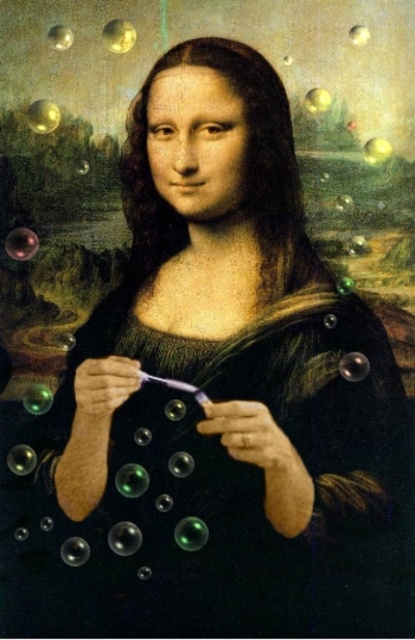
Question: Which object is closer to the camera taking this photo?

Choices:
 (A) transparent glass bubble at upper left
 (B) glossy glass bubble at upper left
 (C) glossy black bubble at lower center

Answer: (A)

Question: Is glossy black bubble at lower center wider than transparent glass bubble at upper right?

Choices:
 (A) yes
 (B) no

Answer: (A)

Question: Which point is closer to the camera taking this photo?

Choices:
 (A) (192, 531)
 (B) (48, 102)
 (C) (127, 49)

Answer: (C)

Question: Which point is farther from the camera taking this photo?

Choices:
 (A) (21, 252)
 (B) (107, 45)

Answer: (A)

Question: Does glossy glass bubble at upper left have a smaller size compared to transparent glass bubble at upper left?

Choices:
 (A) yes
 (B) no

Answer: (B)

Question: Does green translucent bubble at center have a lesser width compared to metallic gold bubble at upper left?

Choices:
 (A) no
 (B) yes

Answer: (A)